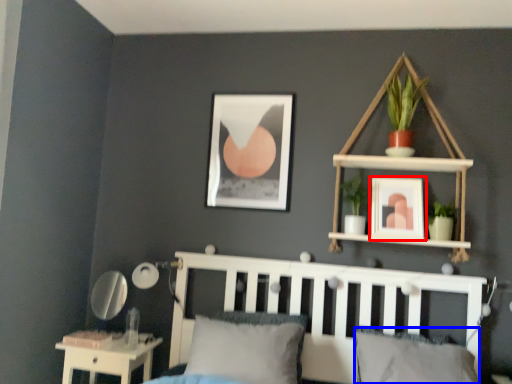
Question: Among these objects, which one is nearest to the camera, picture frame (highlighted by a red box) or pillow (highlighted by a blue box)?

Choices:
 (A) picture frame
 (B) pillow

Answer: (B)